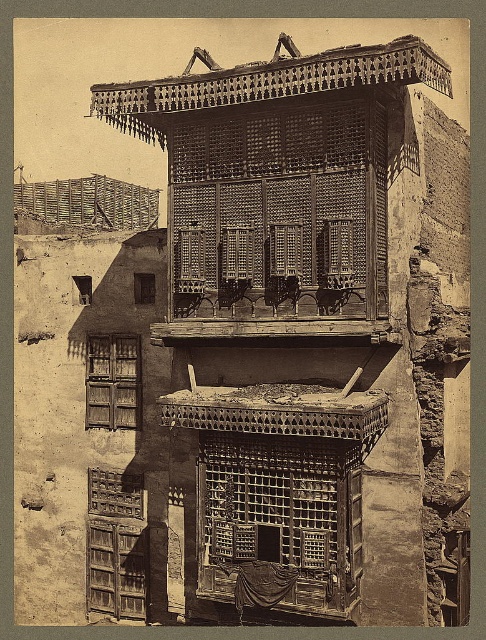
Between rustic wood balcony at upper center and rustic wooden lattice at center, which one appears on the left side from the viewer's perspective?

From the viewer's perspective, rustic wood balcony at upper center appears more on the left side.

Who is shorter, rustic wood balcony at upper center or rustic wooden lattice at center?

rustic wooden lattice at center

Identify the location of rustic wood balcony at upper center. (306, 323).

This screenshot has width=486, height=640. Identify the location of rustic wood balcony at upper center. (306, 323).